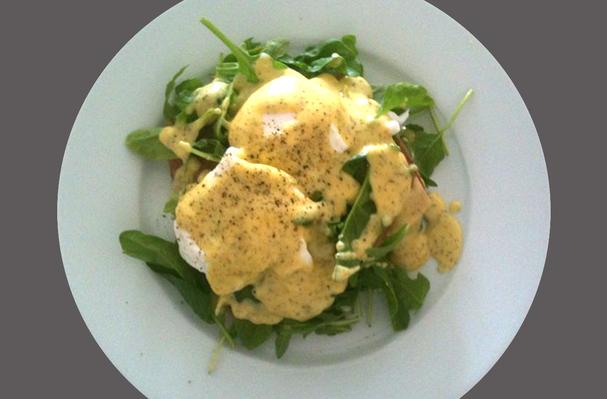
This screenshot has height=399, width=607. What are the coordinates of `plate indent` in the screenshot? It's located at (371, 331), (323, 349).